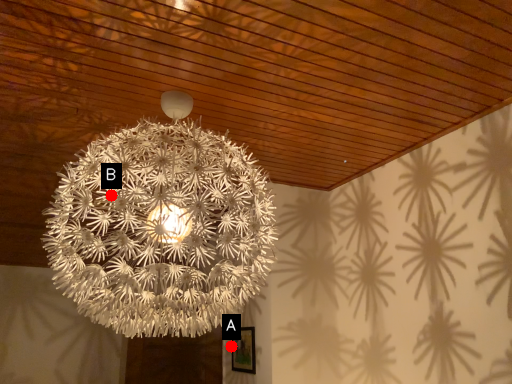
Question: Two points are circled on the image, labeled by A and B beside each circle. Which of the following is the farthest from the observer?

Choices:
 (A) A is further
 (B) B is further

Answer: (A)